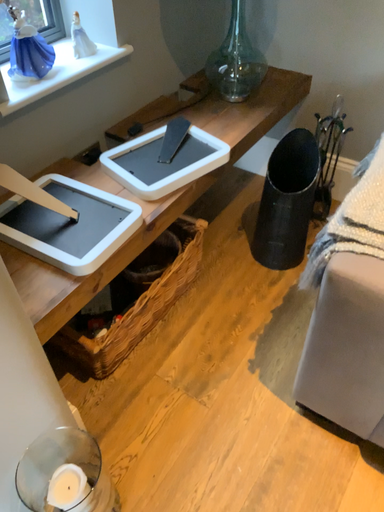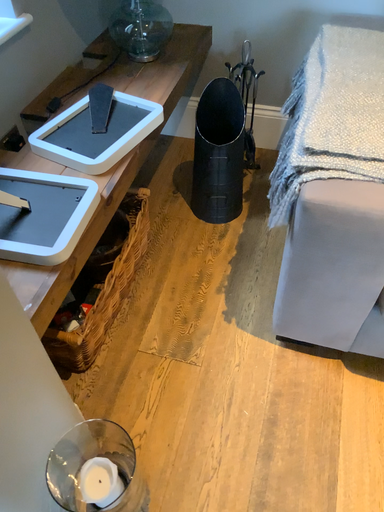
Question: How did the camera likely rotate when shooting the video?

Choices:
 (A) rotated right
 (B) rotated left

Answer: (A)